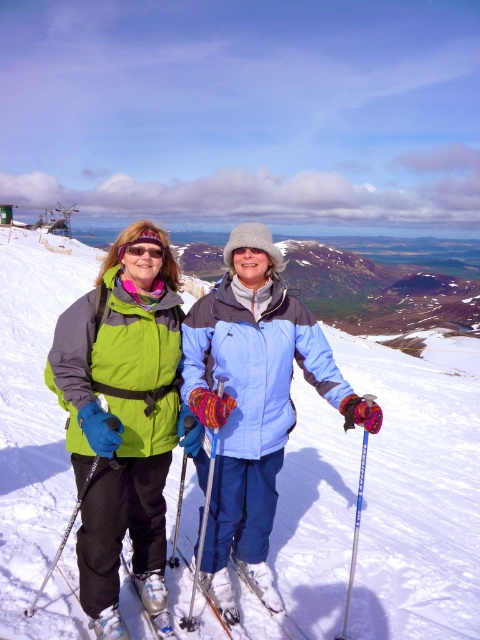
Is matte green jacket at left further to camera compared to blue plastic ski pole at center?

No.

Can you confirm if matte green jacket at left is wider than blue plastic ski pole at center?

Correct, the width of matte green jacket at left exceeds that of blue plastic ski pole at center.

Who is more distant from viewer, (x=101, y=497) or (x=368, y=406)?

Positioned behind is point (x=101, y=497).

Identify the location of matte green jacket at left. (122, 417).

Between matte green jacket at left and white matte ski at lower center, which one is positioned lower?

white matte ski at lower center is lower down.

Does matte green jacket at left have a lesser height compared to white matte ski at lower center?

No.

Which is behind, point (66, 321) or point (299, 636)?

The point (299, 636) is more distant.

At what (x,y) coordinates should I click in order to perform the action: click on matte green jacket at left. Please return your answer as a coordinate pair (x, y). Image resolution: width=480 pixels, height=640 pixels. Looking at the image, I should click on (122, 417).

Between matte green jacket at center and blue plastic ski pole at center, which one appears on the left side from the viewer's perspective?

Result: Positioned to the left is matte green jacket at center.

Is matte green jacket at center smaller than blue plastic ski pole at center?

Actually, matte green jacket at center might be larger than blue plastic ski pole at center.

Who is more distant from viewer, (x=244, y=339) or (x=352, y=572)?

Positioned behind is point (x=244, y=339).

Where is `matte green jacket at center`? The height and width of the screenshot is (640, 480). matte green jacket at center is located at coordinates (251, 404).